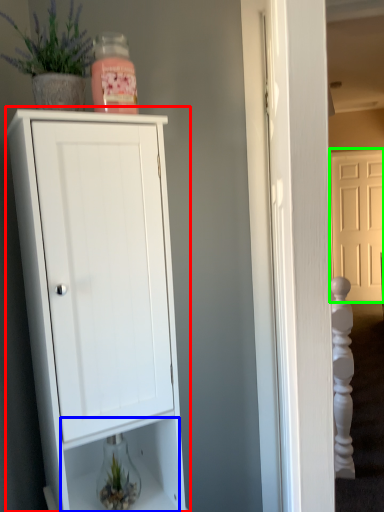
Question: Considering the real-world distances, which object is farthest from cupboard (highlighted by a red box)? drawer (highlighted by a blue box) or door (highlighted by a green box)?

Choices:
 (A) drawer
 (B) door

Answer: (B)